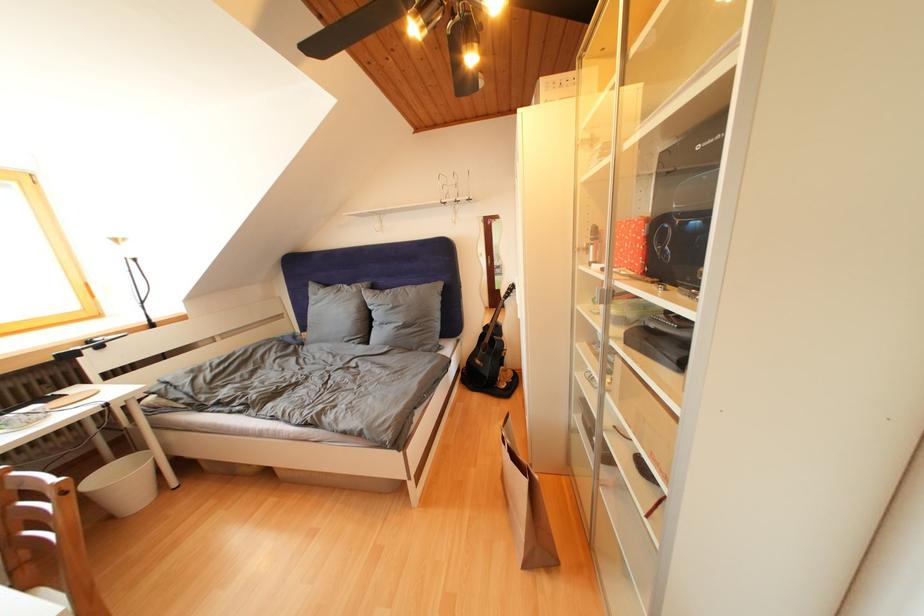
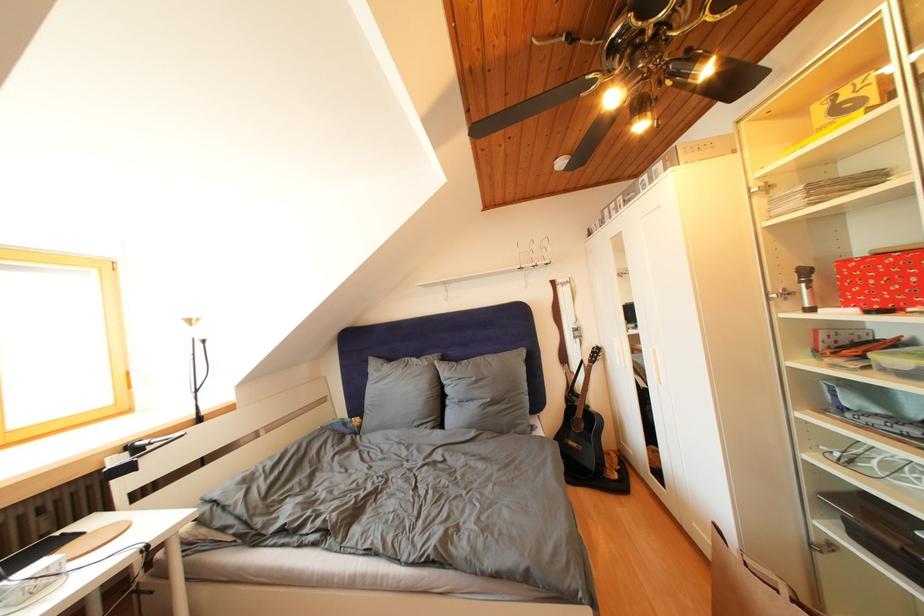
Question: The images are taken continuously from a first-person perspective. In which direction are you moving?

Choices:
 (A) Left
 (B) Right
 (C) Forward
 (D) Backward

Answer: (A)